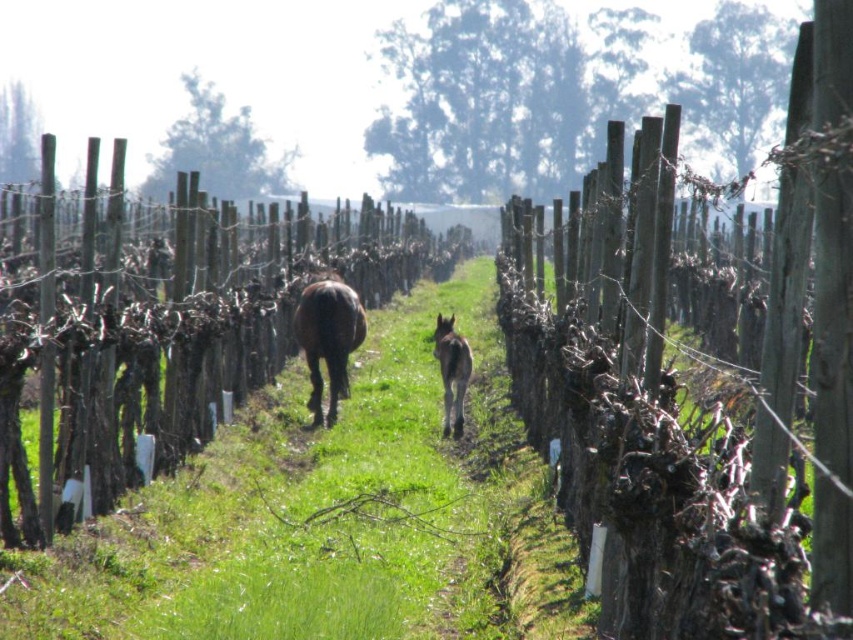
Question: Can you confirm if wooden fence at center is bigger than brown glossy horse at center?

Choices:
 (A) yes
 (B) no

Answer: (A)

Question: Can you confirm if brown glossy horse at center is smaller than brown furry horse at center?

Choices:
 (A) no
 (B) yes

Answer: (A)

Question: Which of these objects is positioned closest to the wooden post at center?

Choices:
 (A) green grass at center
 (B) brown glossy horse at center

Answer: (B)

Question: Which of the following is the farthest from the observer?

Choices:
 (A) wooden fence at center
 (B) green grass at center
 (C) brown glossy horse at center

Answer: (C)

Question: Which point is farther from the camera taking this photo?

Choices:
 (A) (352, 348)
 (B) (338, 278)

Answer: (B)

Question: Can you confirm if green grass at center is positioned to the left of brown glossy horse at center?

Choices:
 (A) yes
 (B) no

Answer: (B)